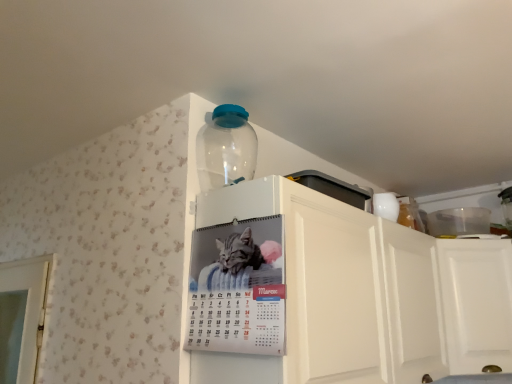
Question: Considering the relative positions of white matte cabinet at upper center and transparent plastic bottle at upper center in the image provided, is white matte cabinet at upper center to the left or to the right of transparent plastic bottle at upper center?

Choices:
 (A) right
 (B) left

Answer: (A)

Question: Based on their sizes in the image, would you say white matte cabinet at upper center is bigger or smaller than transparent plastic bottle at upper center?

Choices:
 (A) small
 (B) big

Answer: (B)

Question: Considering the real-world distances, which object is closest to the white matte cabinet at upper center?

Choices:
 (A) metallic silver calendar at upper center
 (B) transparent plastic bottle at upper center

Answer: (A)

Question: Estimate the real-world distances between objects in this image. Which object is closer to the transparent plastic bottle at upper center?

Choices:
 (A) white matte cabinet at upper center
 (B) metallic silver calendar at upper center

Answer: (B)